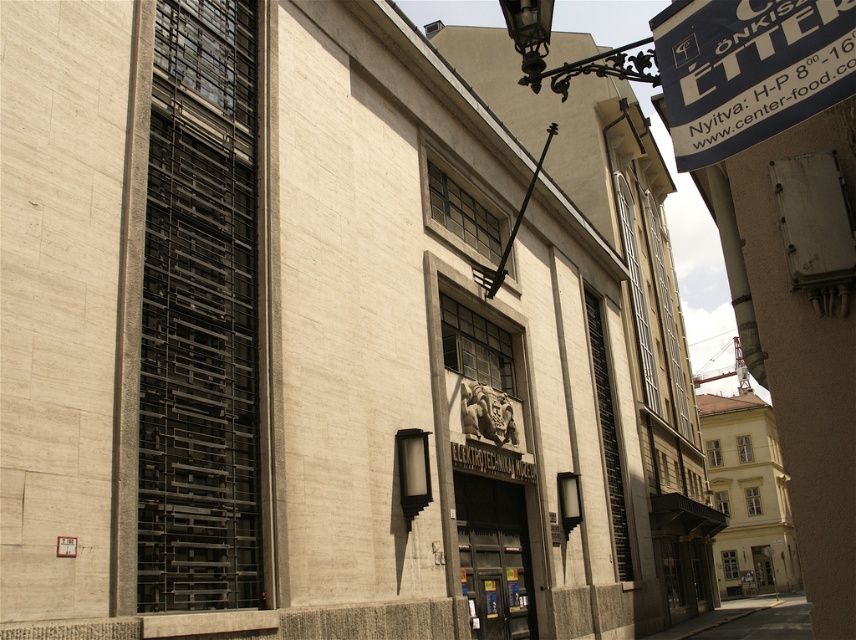
Question: Does blue fabric sign at upper right appear under dark gray concrete alley at lower right?

Choices:
 (A) yes
 (B) no

Answer: (B)

Question: Observing the image, what is the correct spatial positioning of blue fabric sign at upper right in reference to dark gray concrete alley at lower right?

Choices:
 (A) below
 (B) above

Answer: (B)

Question: Does blue fabric sign at upper right have a lesser width compared to dark gray concrete alley at lower right?

Choices:
 (A) yes
 (B) no

Answer: (A)